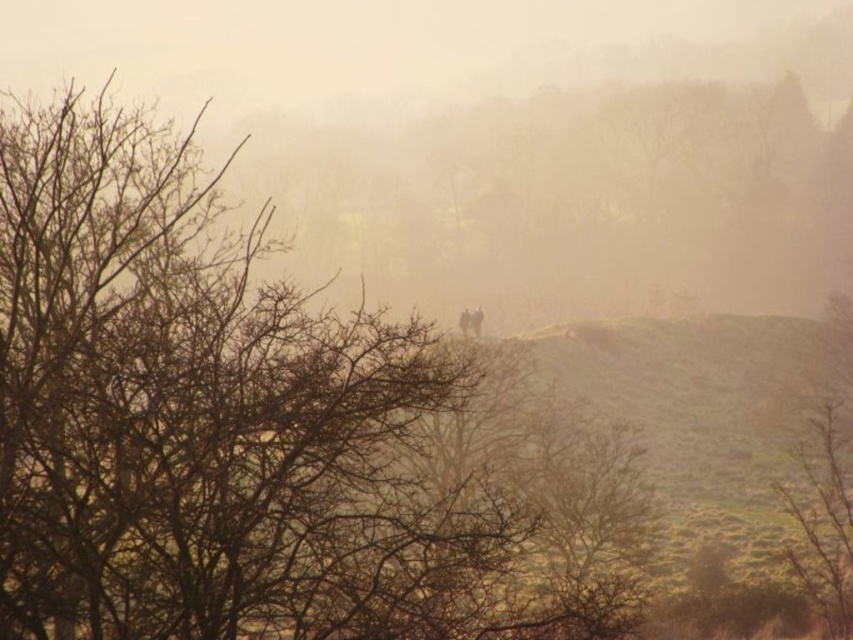
Question: Which of the following is the farthest from the observer?

Choices:
 (A) (15, 595)
 (B) (839, 525)
 (C) (773, 205)

Answer: (C)

Question: Does brown leafless tree at center have a larger size compared to brown matte tree at right?

Choices:
 (A) no
 (B) yes

Answer: (B)

Question: Does foggy atmosphere at center have a smaller size compared to brown matte tree at right?

Choices:
 (A) no
 (B) yes

Answer: (A)

Question: Based on their relative distances, which object is farther from the foggy atmosphere at center?

Choices:
 (A) brown matte tree at right
 (B) brown leafless tree at center

Answer: (A)

Question: Can you confirm if brown leafless tree at center is bigger than foggy atmosphere at center?

Choices:
 (A) yes
 (B) no

Answer: (B)

Question: Based on their relative distances, which object is nearer to the foggy atmosphere at center?

Choices:
 (A) brown matte tree at right
 (B) brown leafless tree at center

Answer: (B)